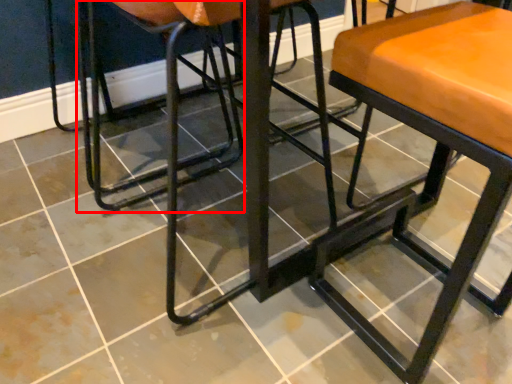
Question: Considering the relative positions of swivel chair (annotated by the red box) and stool in the image provided, where is swivel chair (annotated by the red box) located with respect to the staircase?

Choices:
 (A) left
 (B) right

Answer: (A)